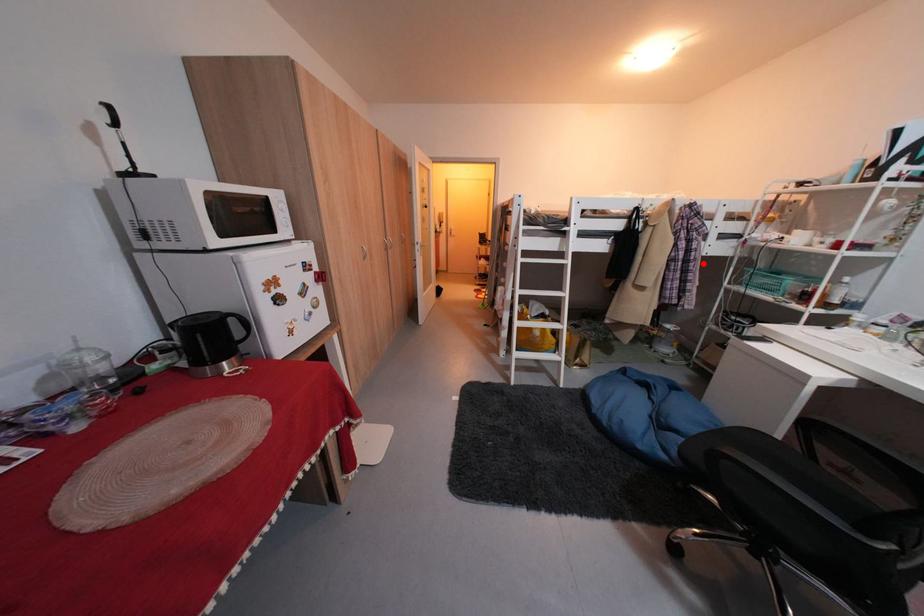
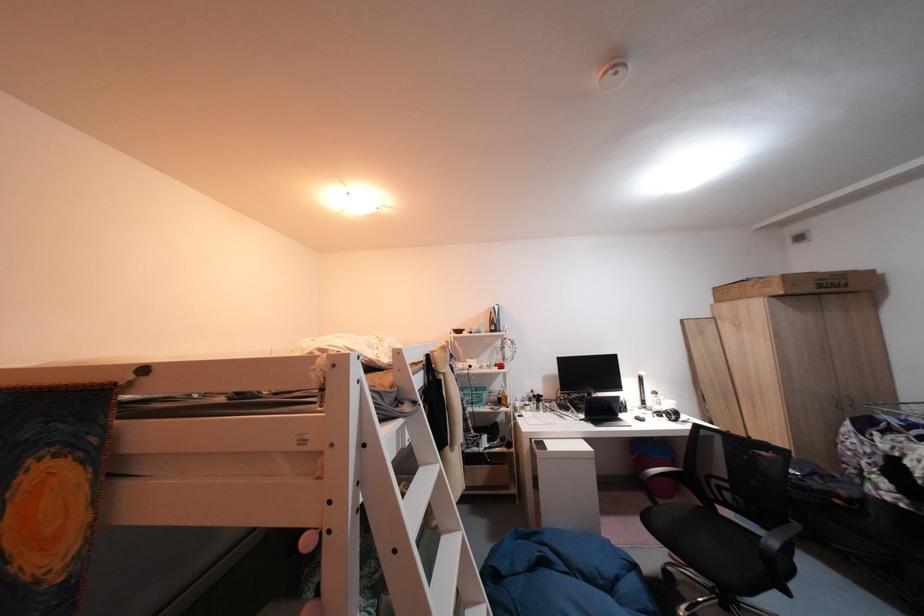
Find the pixel in the second image that matches the highlighted location in the first image.

(475, 400)